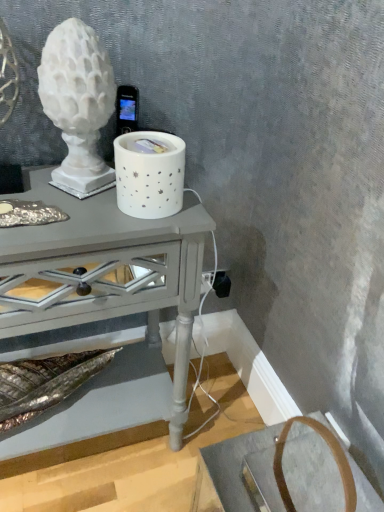
Question: Is black plastic outlet at lower right in contact with matte gray table at center?

Choices:
 (A) no
 (B) yes

Answer: (A)

Question: From a real-world perspective, is black plastic outlet at lower right beneath matte gray table at center?

Choices:
 (A) yes
 (B) no

Answer: (A)

Question: Could you tell me if black plastic outlet at lower right is facing matte gray table at center?

Choices:
 (A) yes
 (B) no

Answer: (B)

Question: Is black plastic outlet at lower right oriented away from matte gray table at center?

Choices:
 (A) no
 (B) yes

Answer: (A)

Question: Is black plastic outlet at lower right taller than matte gray table at center?

Choices:
 (A) no
 (B) yes

Answer: (A)

Question: Considering the positions of white ceramic candle holder at center, the 1th candle holder positioned from the right, and white matte sculpture at upper left, the 2th candle holder positioned from the right, in the image, is white ceramic candle holder at center, the 1th candle holder positioned from the right, wider or thinner than white matte sculpture at upper left, the 2th candle holder positioned from the right,?

Choices:
 (A) wide
 (B) thin

Answer: (A)

Question: Is white ceramic candle holder at center, the second candle holder viewed from the left, spatially inside white matte sculpture at upper left, the 2th candle holder positioned from the right, or outside of it?

Choices:
 (A) inside
 (B) outside

Answer: (B)

Question: Is point (153, 151) closer or farther from the camera than point (102, 53)?

Choices:
 (A) farther
 (B) closer

Answer: (B)

Question: From a real-world perspective, is white ceramic candle holder at center, the 1th candle holder positioned from the right, above or below white matte sculpture at upper left, the 2th candle holder positioned from the right?

Choices:
 (A) below
 (B) above

Answer: (A)

Question: Looking at the image, does white ceramic candle holder at center, the 1th candle holder positioned from the right, seem bigger or smaller compared to matte gray table at center?

Choices:
 (A) big
 (B) small

Answer: (B)

Question: In terms of width, does white ceramic candle holder at center, the 1th candle holder positioned from the right, look wider or thinner when compared to matte gray table at center?

Choices:
 (A) thin
 (B) wide

Answer: (A)

Question: Considering their positions, is white ceramic candle holder at center, the 1th candle holder positioned from the right, located in front of or behind matte gray table at center?

Choices:
 (A) front
 (B) behind

Answer: (B)

Question: Considering the positions of point (177, 184) and point (84, 237), is point (177, 184) closer or farther from the camera than point (84, 237)?

Choices:
 (A) closer
 (B) farther

Answer: (B)

Question: In terms of size, does white matte sculpture at upper left, the first candle holder when ordered from left to right, appear bigger or smaller than matte gray table at center?

Choices:
 (A) small
 (B) big

Answer: (A)

Question: Choose the correct answer: Is white matte sculpture at upper left, the first candle holder when ordered from left to right, inside matte gray table at center or outside it?

Choices:
 (A) inside
 (B) outside

Answer: (B)